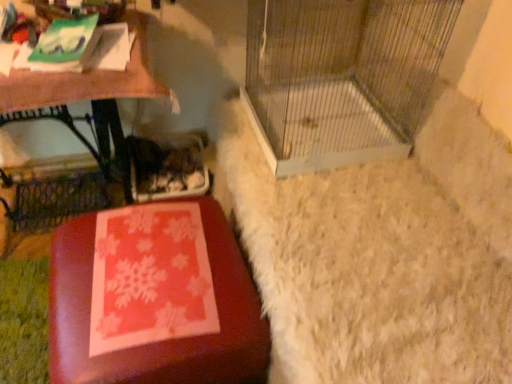
At what (x,y) coordinates should I click in order to perform the action: click on metal wire birdcage at center. Please return your answer as a coordinate pair (x, y). The image size is (512, 384). Looking at the image, I should click on (341, 77).

At what (x,y) coordinates should I click in order to perform the action: click on matte red ottoman at lower left. Please return your answer as a coordinate pair (x, y). Image resolution: width=512 pixels, height=384 pixels. Looking at the image, I should click on (159, 342).

In terms of height, does matte red ottoman at lower left look taller or shorter compared to wooden table at left?

matte red ottoman at lower left is shorter than wooden table at left.

Considering the relative sizes of matte red ottoman at lower left and wooden table at left in the image provided, is matte red ottoman at lower left smaller than wooden table at left?

Yes.

From the image's perspective, which object appears higher, matte red ottoman at lower left or wooden table at left?

wooden table at left is shown above in the image.

Is matte red ottoman at lower left wider or thinner than wooden table at left?

Clearly, matte red ottoman at lower left has more width compared to wooden table at left.

What's the angular difference between metal wire birdcage at center and matte red ottoman at lower left's facing directions?

The facing directions of metal wire birdcage at center and matte red ottoman at lower left are 3.77 degrees apart.

Is metal wire birdcage at center thinner than matte red ottoman at lower left?

No.

Considering the relative positions of metal wire birdcage at center and matte red ottoman at lower left in the image provided, is metal wire birdcage at center to the left of matte red ottoman at lower left from the viewer's perspective?

No, metal wire birdcage at center is not to the left of matte red ottoman at lower left.

Can matte red ottoman at lower left be found inside metal wire birdcage at center?

That's incorrect, matte red ottoman at lower left is not inside metal wire birdcage at center.

Does point (265, 14) appear closer or farther from the camera than point (117, 80)?

Point (265, 14) is farther from the camera than point (117, 80).

Does metal wire birdcage at center lie in front of wooden table at left?

Yes, metal wire birdcage at center is closer to the camera.

From the image's perspective, would you say metal wire birdcage at center is positioned over wooden table at left?

Yes, from the image's perspective, metal wire birdcage at center is over wooden table at left.

Who is taller, metal wire birdcage at center or wooden table at left?

wooden table at left.

Where is `furniture lying on the right of wooden table at left`? furniture lying on the right of wooden table at left is located at coordinates (159, 342).

Consider the image. From a real-world perspective, which is physically below, wooden table at left or matte red ottoman at lower left?

In real-world perspective, matte red ottoman at lower left is lower.

Considering the sizes of objects wooden table at left and matte red ottoman at lower left in the image provided, who is thinner, wooden table at left or matte red ottoman at lower left?

With smaller width is wooden table at left.

Is wooden table at left facing away from matte red ottoman at lower left?

No, wooden table at left's orientation is not away from matte red ottoman at lower left.

From the picture: Does wooden table at left have a smaller size compared to metal wire birdcage at center?

Actually, wooden table at left might be larger than metal wire birdcage at center.

From the image's perspective, is wooden table at left located above metal wire birdcage at center?

No, from the image's perspective, wooden table at left is not over metal wire birdcage at center.

Considering the sizes of objects wooden table at left and metal wire birdcage at center in the image provided, who is taller, wooden table at left or metal wire birdcage at center?

wooden table at left.

Is point (74, 260) behind point (414, 38)?

No.

Could you tell me if matte red ottoman at lower left is facing metal wire birdcage at center?

No.

What's the angular difference between matte red ottoman at lower left and metal wire birdcage at center's facing directions?

3.77 degrees.

In the scene shown: Measure the distance from matte red ottoman at lower left to metal wire birdcage at center.

A distance of 22.76 inches exists between matte red ottoman at lower left and metal wire birdcage at center.

Locate an element on the screen. table behind the matte red ottoman at lower left is located at coordinates (85, 80).

Find the location of a particular element. furniture that is under the metal wire birdcage at center (from a real-world perspective) is located at coordinates [x=159, y=342].

Considering their positions, is matte red ottoman at lower left positioned closer to metal wire birdcage at center than wooden table at left?

wooden table at left.

Based on their spatial positions, is metal wire birdcage at center or matte red ottoman at lower left closer to wooden table at left?

matte red ottoman at lower left.

From the image, which object appears to be farther from matte red ottoman at lower left, metal wire birdcage at center or wooden table at left?

metal wire birdcage at center is positioned further to the anchor matte red ottoman at lower left.

Estimate the real-world distances between objects in this image. Which object is further from matte red ottoman at lower left, wooden table at left or metal wire birdcage at center?

metal wire birdcage at center is positioned further to the anchor matte red ottoman at lower left.

Consider the image. From the image, which object appears to be farther from wooden table at left, matte red ottoman at lower left or metal wire birdcage at center?

metal wire birdcage at center lies further to wooden table at left than the other object.

When comparing their distances from metal wire birdcage at center, does wooden table at left or matte red ottoman at lower left seem further?

Based on the image, matte red ottoman at lower left appears to be further to metal wire birdcage at center.

This screenshot has height=384, width=512. I want to click on furniture situated between wooden table at left and metal wire birdcage at center from left to right, so click(x=159, y=342).